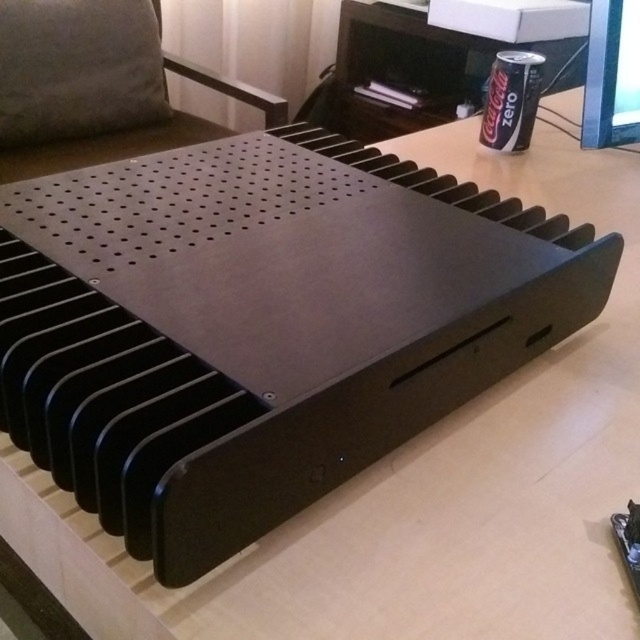
You are a delivery person who needs to place a new monitor on the desk without moving the black computer case. The desk has limited space. The metallic silver monitor at upper right is currently on the desk. Can you estimate whether the new monitor will fit on the desk if it is 38 inches wide?

The metallic silver monitor at upper right is 37.03 inches away from viewer. Since the new monitor is 38 inches wide, it is slightly wider than the existing monitor. However, the distance from the viewer to the monitor does not directly indicate desk space availability. The desk space depends on the desk dimensions and other objects present. Without additional information about the desk size or other obstructions, it is impossible to accurately determine if the new monitor will fit.

From the picture: You are setting up a new computer setup. You have a black matte metal object at center and a metallic silver monitor at upper right. According to the image, which object is positioned to the left of the other?

The black matte metal object at center is to the left of the metallic silver monitor at upper right.

You are moving a black matte metal object at center to a shelf that is 5 feet away. Can you place it there without moving it more than 5 feet?

The black matte metal object at center is 5.66 feet away from the shelf, so you cannot place it there without moving it more than 5 feet.